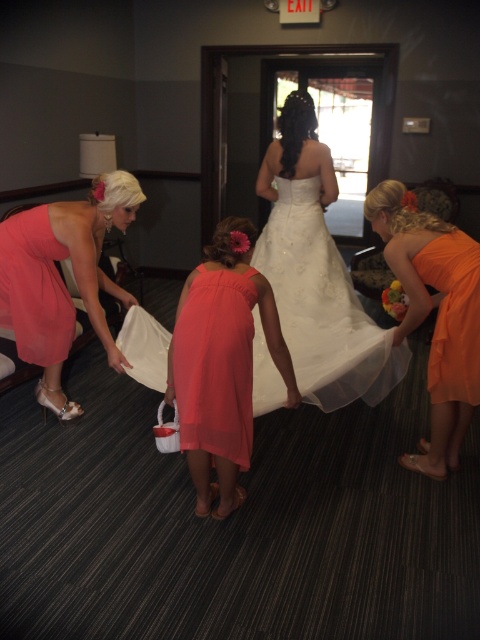
Question: Which point is farther to the camera?

Choices:
 (A) (243, 282)
 (B) (416, 273)
 (C) (48, 250)

Answer: (C)

Question: Does coral satin dress at left appear over orange satin dress at right?

Choices:
 (A) no
 (B) yes

Answer: (B)

Question: Does matte coral dress at center appear under matte pink dress at left?

Choices:
 (A) no
 (B) yes

Answer: (B)

Question: Which point is farther to the camera?

Choices:
 (A) matte pink dress at left
 (B) orange satin dress at right
 (C) coral satin dress at left

Answer: (A)

Question: Can you confirm if white satin dress at center is positioned above matte pink dress at left?

Choices:
 (A) yes
 (B) no

Answer: (A)

Question: Which of the following is the closest to the observer?

Choices:
 (A) (218, 355)
 (B) (245, 452)

Answer: (A)